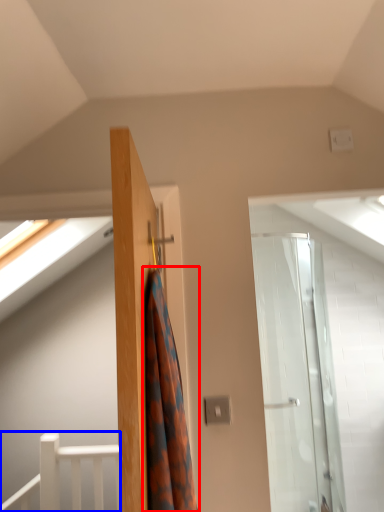
Question: Which object is further to the camera taking this photo, shower curtain (highlighted by a red box) or rail (highlighted by a blue box)?

Choices:
 (A) shower curtain
 (B) rail

Answer: (B)